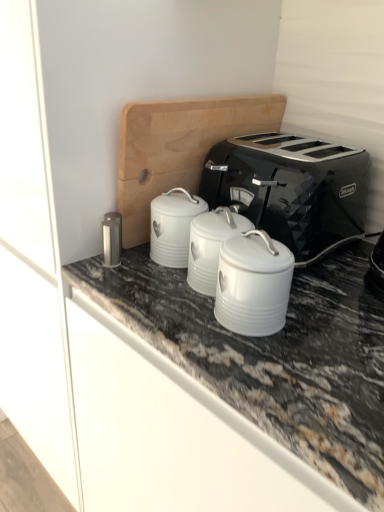
Question: Considering the positions of satin silver canister at center-left, which ranks as the first appliance in left-to-right order, and black metallic toaster at center in the image, is satin silver canister at center-left, which ranks as the first appliance in left-to-right order, wider or thinner than black metallic toaster at center?

Choices:
 (A) thin
 (B) wide

Answer: (A)

Question: Based on their sizes in the image, would you say satin silver canister at center-left, marked as the third appliance in a right-to-left arrangement, is bigger or smaller than black metallic toaster at center?

Choices:
 (A) big
 (B) small

Answer: (B)

Question: Estimate the real-world distances between objects in this image. Which object is farther from the black metallic toaster at center?

Choices:
 (A) satin silver canister at center-left, which ranks as the first appliance in left-to-right order
 (B) white enameled canister at center, the 2th appliance when ordered from right to left
 (C) white ceramic canister at center, the third appliance in the left-to-right sequence

Answer: (A)

Question: Which is nearer to the white ceramic canister at center, the first appliance viewed from the right?

Choices:
 (A) white enameled canister at center, which appears as the 2th appliance when viewed from the left
 (B) satin silver canister at center-left, marked as the third appliance in a right-to-left arrangement
 (C) black metallic toaster at center

Answer: (A)